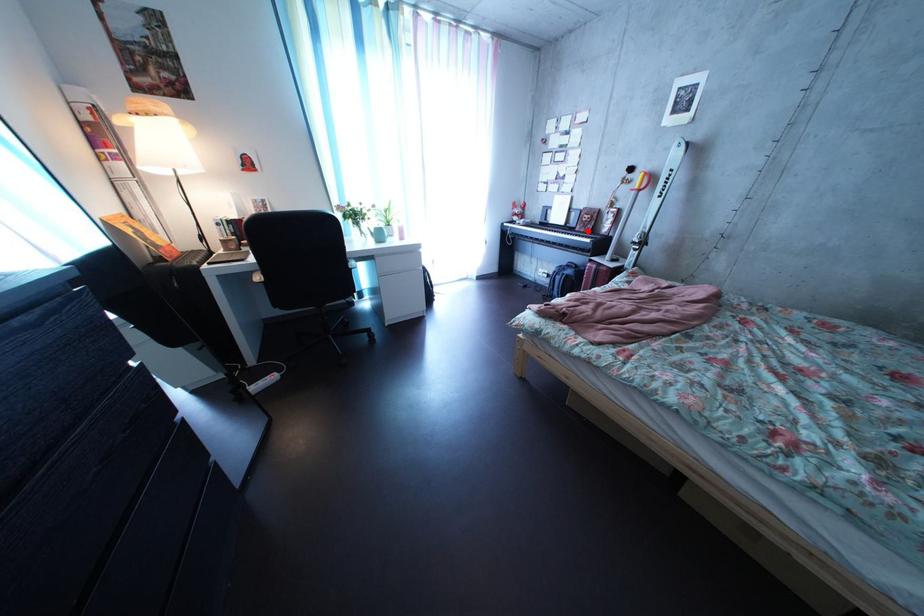
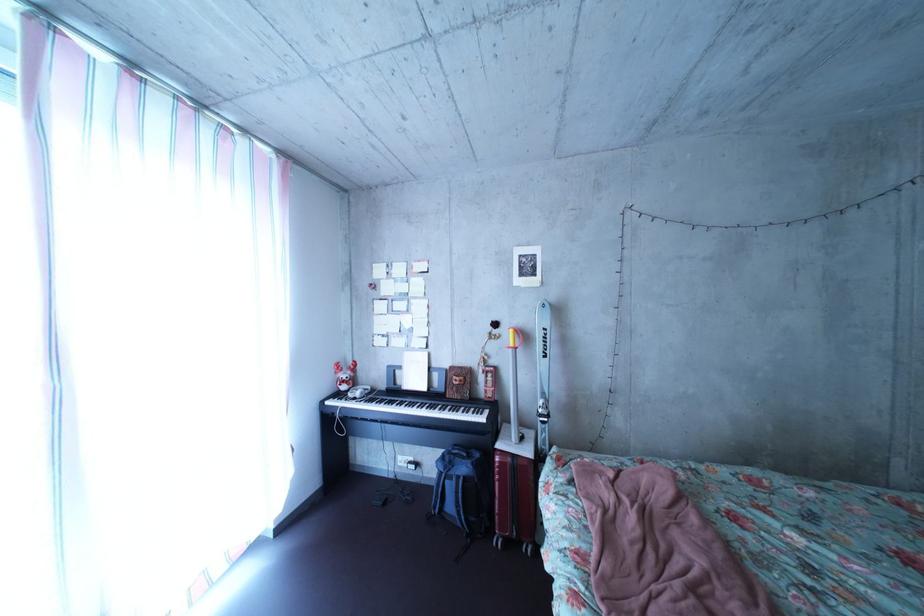
In the second image, find the point that corresponds to the highlighted location in the first image.

(452, 392)